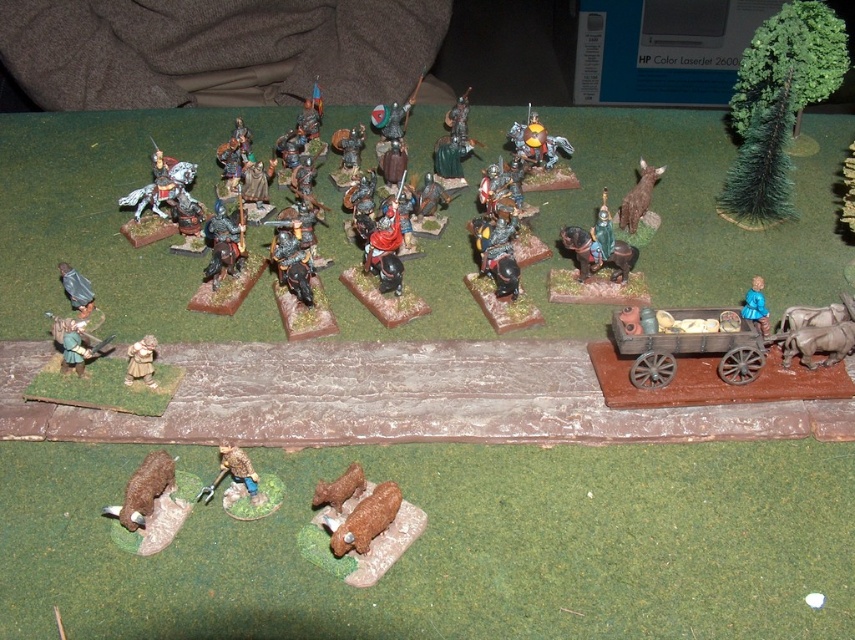
You are a miniature figure collector examining a diorama. You notice the matte brown figure at lower left. Where exactly is it located in the image?

The matte brown figure at lower left is located at the 2D coordinates point (140, 362) in the image.

You are a knight in the diorama and need to reach the brown matte cow at lower left. If your sword has a reach of 3 feet, can you touch the cow with your sword?

The brown matte cow at lower left is 4.21 feet away from the viewer, which is beyond the 3 feet reach of your sword. You cannot touch the cow with your sword.